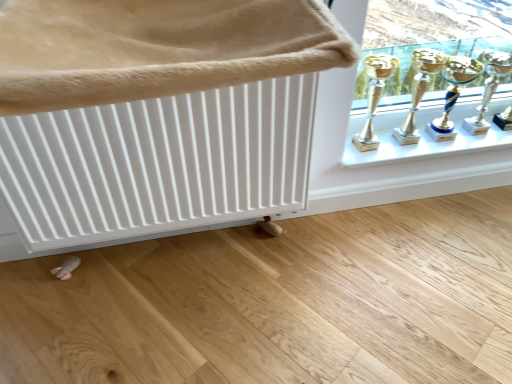
Question: Is silver metallic trophy at upper right, the 1th candle holder when ordered from right to left, bigger or smaller than gold metallic trophy at upper right, marked as the second trophy in a right-to-left arrangement?

Choices:
 (A) big
 (B) small

Answer: (B)

Question: Choose the correct answer: Is silver metallic trophy at upper right, the 1th candle holder when ordered from right to left, inside gold metallic trophy at upper right, marked as the second trophy in a right-to-left arrangement, or outside it?

Choices:
 (A) inside
 (B) outside

Answer: (B)

Question: Considering the real-world distances, which object is closest to the white textured radiator at upper left?

Choices:
 (A) silver metallic trophy at upper right, acting as the 2th candle holder starting from the left
 (B) white matte radiator at upper left
 (C) gold metallic trophy at upper right, marked as the 1th trophy in a left-to-right arrangement
 (D) gold metallic trophy at upper right, which ranks as the second candle holder in right-to-left order
 (E) gold metallic trophy at upper right, which is the first trophy in right-to-left order

Answer: (B)

Question: Based on their relative distances, which object is farther from the gold metallic trophy at upper right, which is the 1th candle holder from left to right?

Choices:
 (A) white glossy window sill at upper right
 (B) white matte radiator at upper left
 (C) silver metallic trophy at upper right, acting as the 2th candle holder starting from the left
 (D) white textured radiator at upper left
 (E) gold metallic trophy at upper right, marked as the 1th trophy in a left-to-right arrangement

Answer: (D)